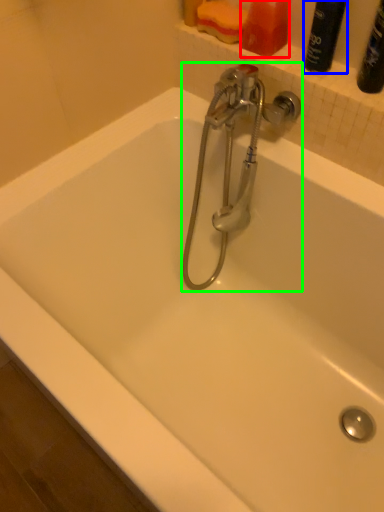
Question: Which object is the closest to the toiletry (highlighted by a red box)? Choose among these: cleaning product (highlighted by a blue box) or tap (highlighted by a green box).

Choices:
 (A) cleaning product
 (B) tap

Answer: (A)